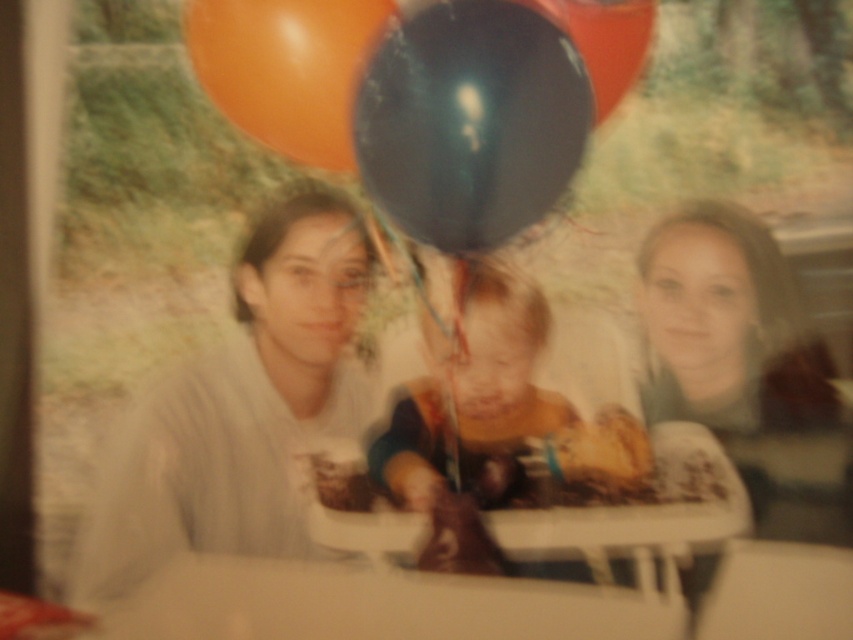
Which is more to the right, matte gray sweater at left or white plastic table at lower center?

white plastic table at lower center is more to the right.

Can you confirm if matte gray sweater at left is shorter than white plastic table at lower center?

Incorrect, matte gray sweater at left's height does not fall short of white plastic table at lower center's.

Measure the distance between point (364, 268) and camera.

6.58 feet

Identify the location of matte gray sweater at left. The width and height of the screenshot is (853, 640). (241, 406).

Which is in front, point (767, 266) or point (349, 140)?

Positioned in front is point (349, 140).

Can you confirm if matte gray sweater at upper right is positioned to the right of orange rubber balloon at upper left?

Indeed, matte gray sweater at upper right is positioned on the right side of orange rubber balloon at upper left.

Does point (695, 214) lie in front of point (328, 8)?

No, (695, 214) is further to viewer.

Find the location of a particular element. Image resolution: width=853 pixels, height=640 pixels. matte gray sweater at upper right is located at coordinates [746, 365].

Can you confirm if black rubber balloon at upper center is wider than matte gray sweater at upper right?

In fact, black rubber balloon at upper center might be narrower than matte gray sweater at upper right.

Does black rubber balloon at upper center have a smaller size compared to matte gray sweater at upper right?

Yes, black rubber balloon at upper center is smaller than matte gray sweater at upper right.

At what (x,y) coordinates should I click in order to perform the action: click on black rubber balloon at upper center. Please return your answer as a coordinate pair (x, y). Image resolution: width=853 pixels, height=640 pixels. Looking at the image, I should click on point(469,122).